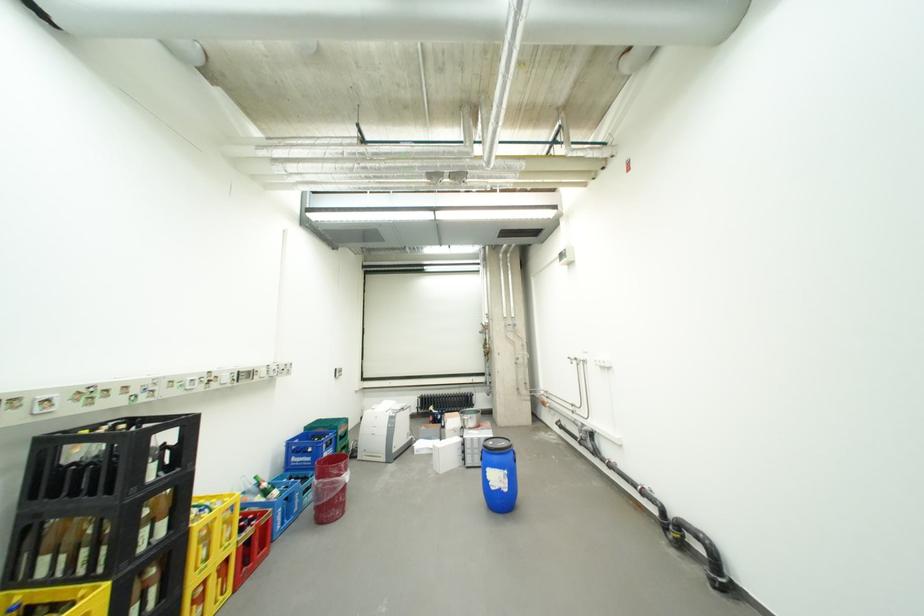
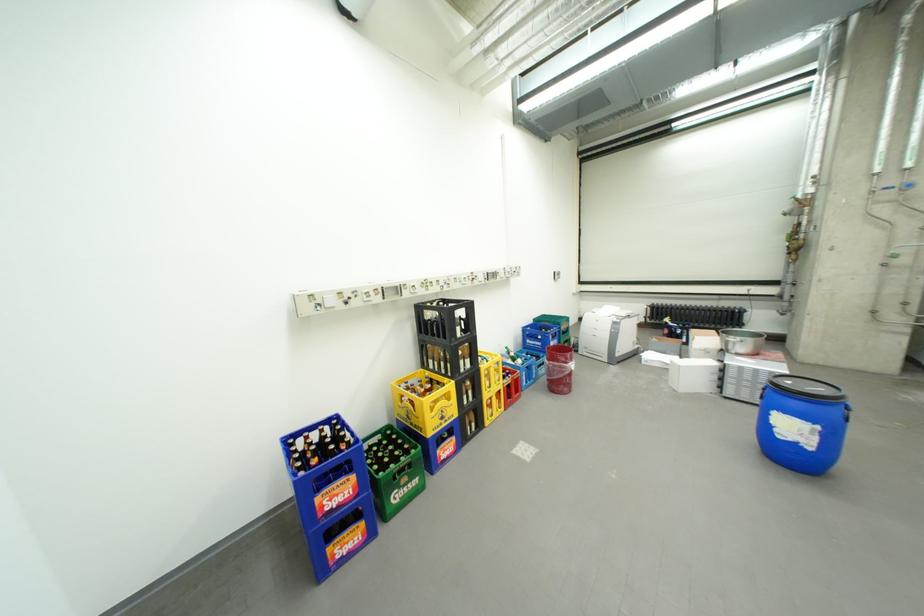
The point at (344,419) is marked in the first image. Where is the corresponding point in the second image?

(565, 317)